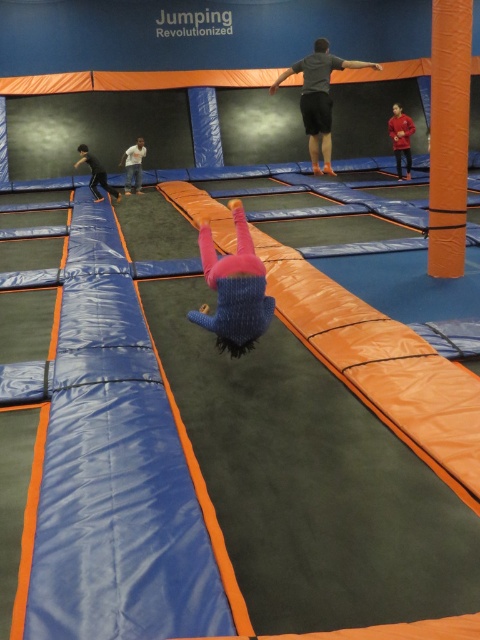
Based on the photo, you are designing a new trampoline park uniform and need to ensure that the gray fabric shorts at center and the blue fuzzy sweater at left will fit through the safety gates. The gates are 1 meter wide. Based on the image, will both items fit through the gates when worn by a person?

The gray fabric shorts at center might be wider than blue fuzzy sweater at left, but since the safety gates are 1 meter wide, both items should fit through as their widths are likely within the gate dimensions.

You are standing at the entrance of the trampoline park and see two people in the center area. One is wearing knitted pink pants at center and the other is wearing blue fuzzy sweater at left. Which person is closer to you?

The knitted pink pants at center is closer to the viewer than the blue fuzzy sweater at left, so the person wearing knitted pink pants at center is closer to you.